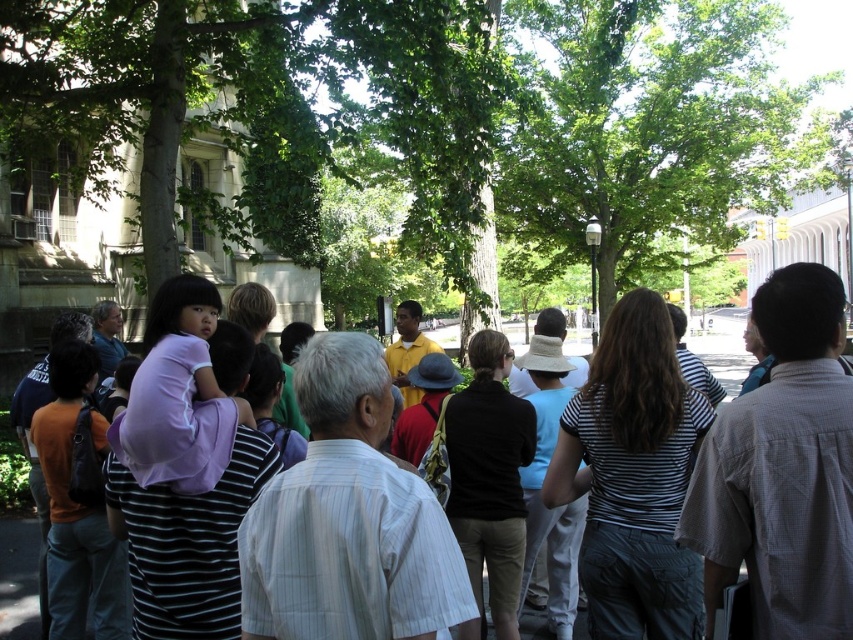
Is green leafy tree at left shorter than purple fabric at center?

No, green leafy tree at left is not shorter than purple fabric at center.

Can you confirm if green leafy tree at left is positioned below purple fabric at center?

No, green leafy tree at left is not below purple fabric at center.

Find the location of `green leafy tree at left`. green leafy tree at left is located at coordinates (265, 109).

Find the location of a particular element. This screenshot has width=853, height=640. green leafy tree at left is located at coordinates (265, 109).

Which is below, green leafy tree at left or green leafy tree at center?

Positioned lower is green leafy tree at left.

This screenshot has height=640, width=853. In order to click on green leafy tree at left in this screenshot , I will do `click(265, 109)`.

Does green leafy tree at center have a lesser width compared to purple fabric at center?

Yes.

Is point (523, 104) farther from viewer compared to point (15, 620)?

Yes, point (523, 104) is farther from viewer.

This screenshot has width=853, height=640. In order to click on green leafy tree at center in this screenshot , I will do `click(647, 131)`.